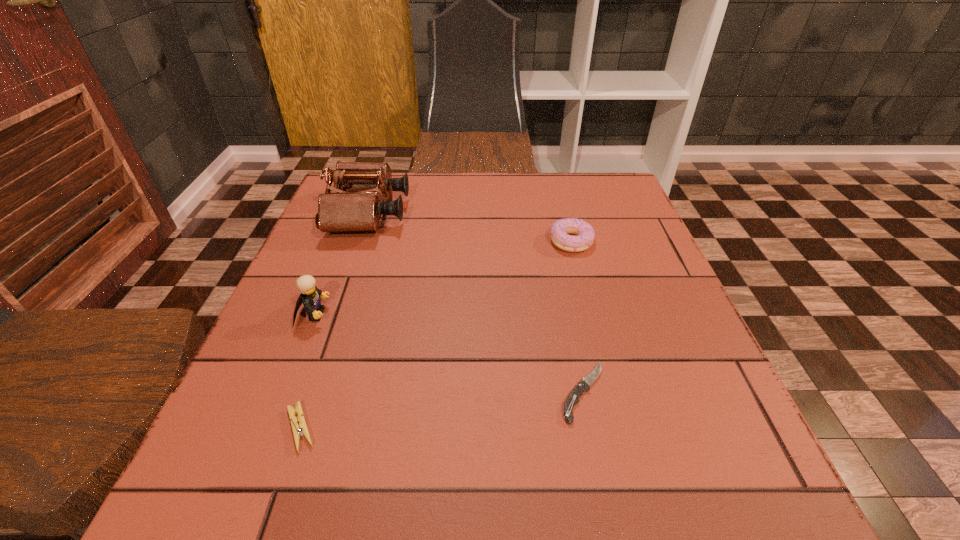
The height and width of the screenshot is (540, 960). I want to click on free spot located 0.250m on the right of the clothespin, so click(x=484, y=428).

You are a GUI agent. You are given a task and a screenshot of the screen. Output one action in this format:
    pyautogui.click(x=<x>, y=<y>)
    Task: Click on the object that is at the far edge
    The image size is (960, 540).
    Given the screenshot: What is the action you would take?
    pyautogui.click(x=356, y=206)

What are the coordinates of `binoculars present at the left edge` in the screenshot? It's located at (356, 206).

Where is `Lego positioned at the left edge`? The width and height of the screenshot is (960, 540). Lego positioned at the left edge is located at coordinates (310, 295).

Where is `clothespin present at the left edge`? clothespin present at the left edge is located at coordinates (298, 431).

The image size is (960, 540). I want to click on object that is at the right edge, so 585,234.

The width and height of the screenshot is (960, 540). I want to click on object that is at the far left corner, so click(x=356, y=206).

At what (x,y) coordinates should I click in order to perform the action: click on vacant space at the far edge of the desktop. Please return your answer as a coordinate pair (x, y). Looking at the image, I should click on point(449,204).

The image size is (960, 540). Identify the location of free location at the near edge of the desktop. (634, 468).

Identify the location of vacant space at the left edge of the desktop. The image size is (960, 540). (373, 254).